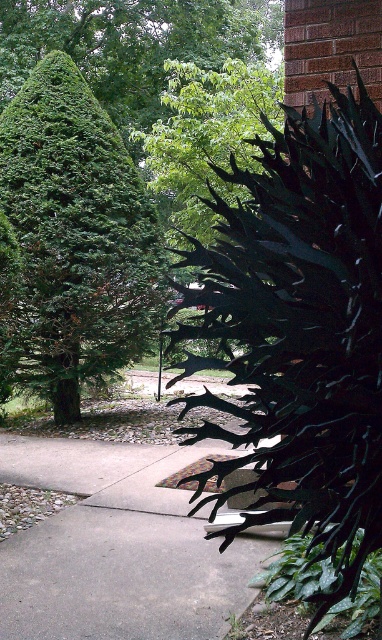
You are a gardener with a 3.0 meter long hose. You need to water both the gray concrete pavement at center and the green leafy tree at left. Can you reach both from your current position without moving the hose?

The gray concrete pavement at center and the green leafy tree at left are 2.77 meters apart from each other. Since the hose is 3.0 meters long, which is longer than the distance between them, you can reach both without moving the hose.

You are standing on the path and want to take a photo of both the green matte bush at right and the green leafy tree at left. Which object should you position closer to the camera to include both in the frame?

You should position the green matte bush at right closer to the camera since it is in front of the green leafy tree at left, allowing both to be in the frame without one blocking the other.

Based on the photo, you are standing at the entrance of the house and want to place a 7 feet long bench between the green matte bush at right and the brick house. Is there enough space?

The distance between the green matte bush at right and the brick house is 6.75 feet. Since the bench is 7 feet long, it won not fit in the available space.